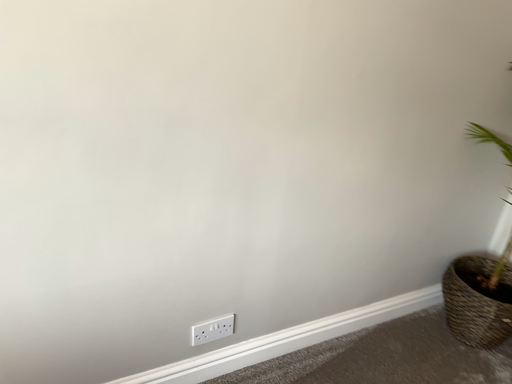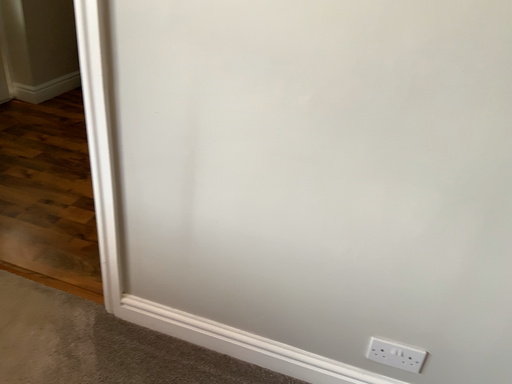
Question: Which way did the camera rotate in the video?

Choices:
 (A) rotated upward
 (B) rotated downward

Answer: (A)